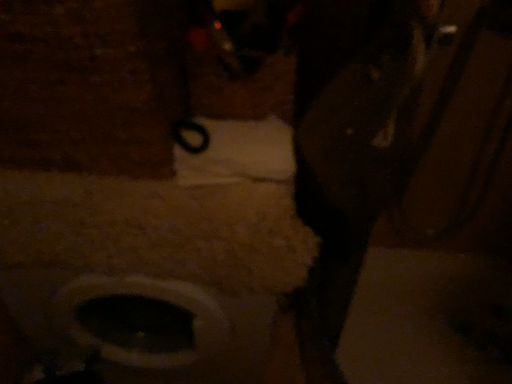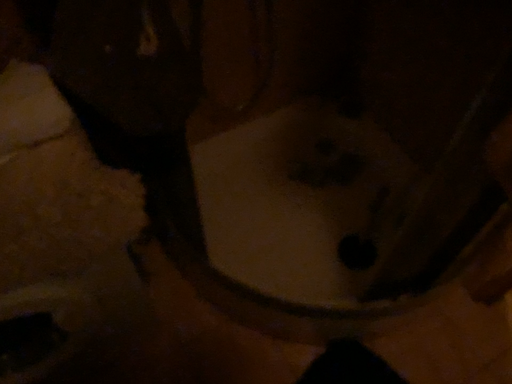
Question: Which way did the camera rotate in the video?

Choices:
 (A) rotated right
 (B) rotated left

Answer: (A)